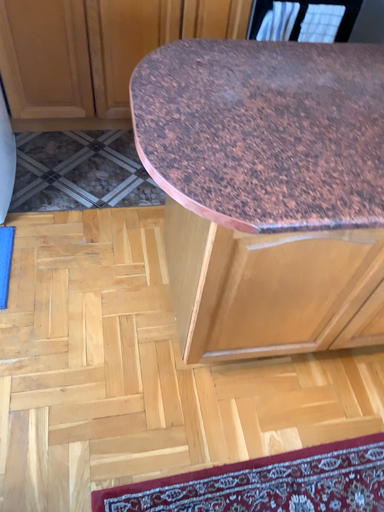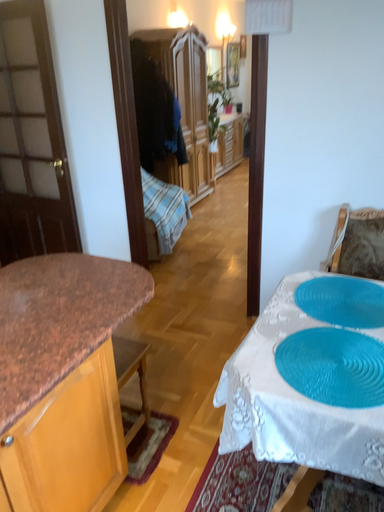
Question: How did the camera likely rotate when shooting the video?

Choices:
 (A) rotated left
 (B) rotated right

Answer: (B)